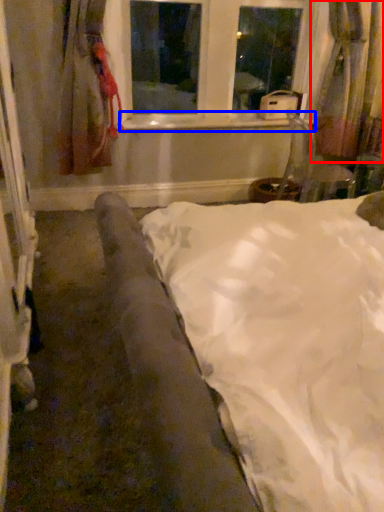
Question: Which object appears closest to the camera in this image, curtain (highlighted by a red box) or window sill (highlighted by a blue box)?

Choices:
 (A) curtain
 (B) window sill

Answer: (A)